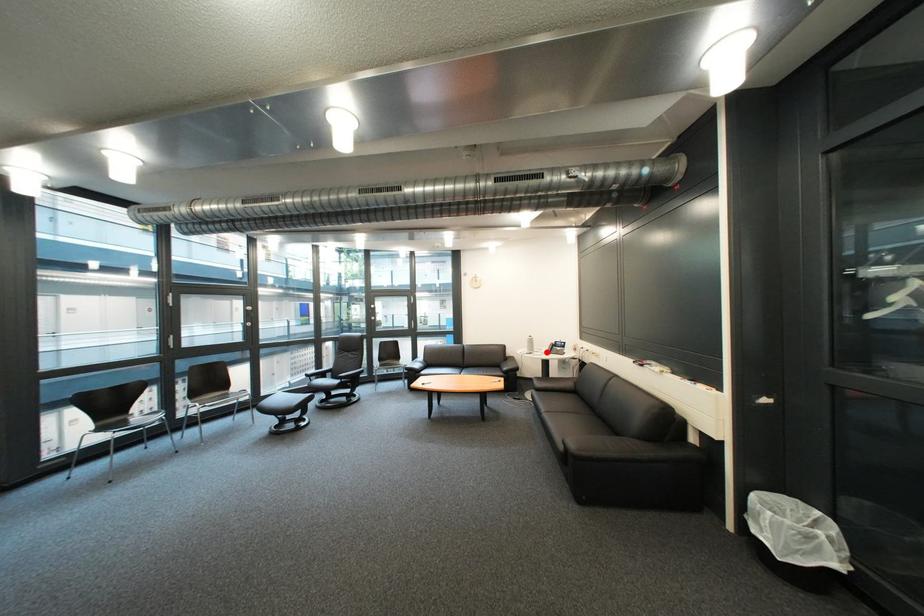
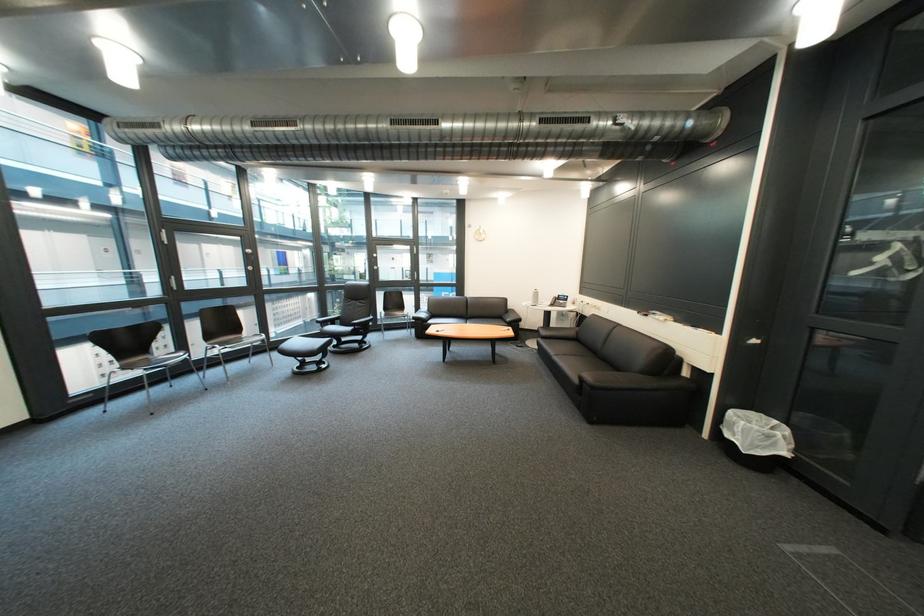
The point at the highlighted location is marked in the first image. Where is the corresponding point in the second image?

(552, 305)